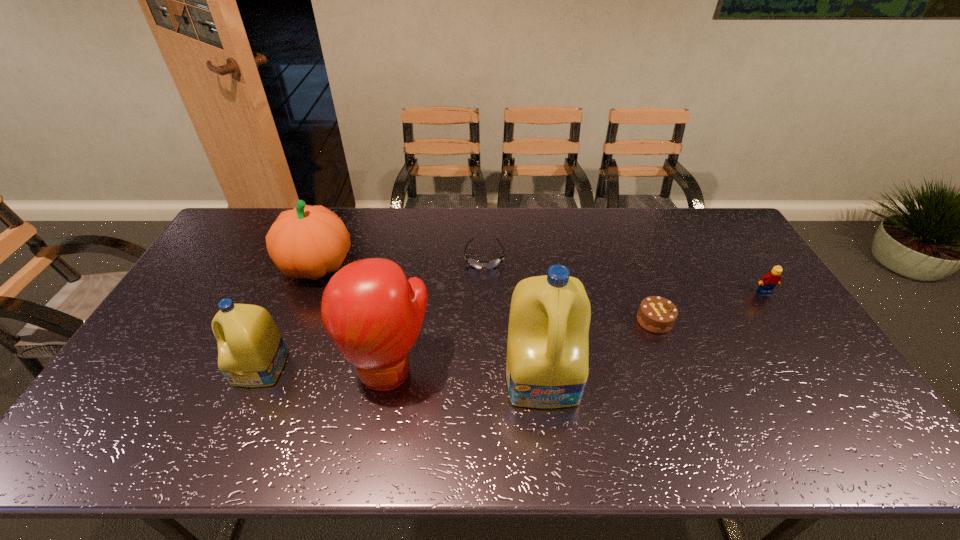
Considering the uniform spacing of detergents, where should an additional detergent be positioned on the right? Please locate a free spot. Please provide its 2D coordinates. Your answer should be formatted as a tuple, i.e. [(x, y)], where the tuple contains the x and y coordinates of a point satisfying the conditions above.

[(837, 387)]